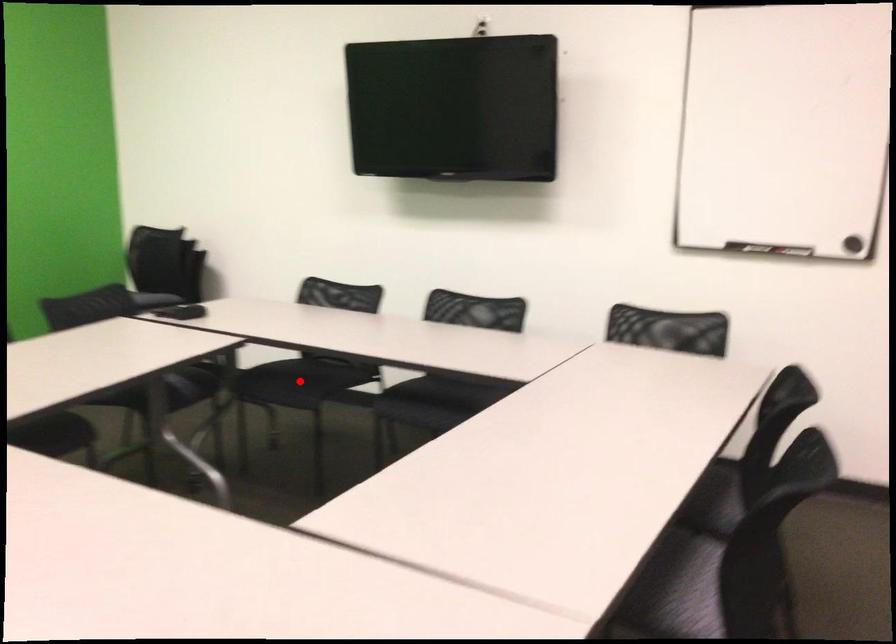
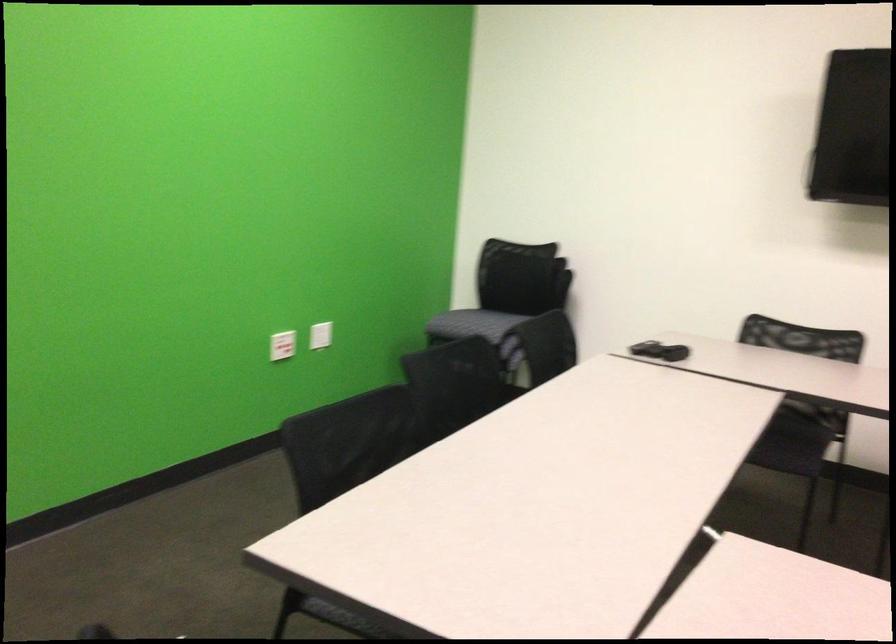
Question: I am providing you with two images of the same scene from different viewpoints. A red point is shown in image1. For the corresponding object point in image2, is it positioned nearer or farther from the camera?

Choices:
 (A) Nearer
 (B) Farther

Answer: (A)